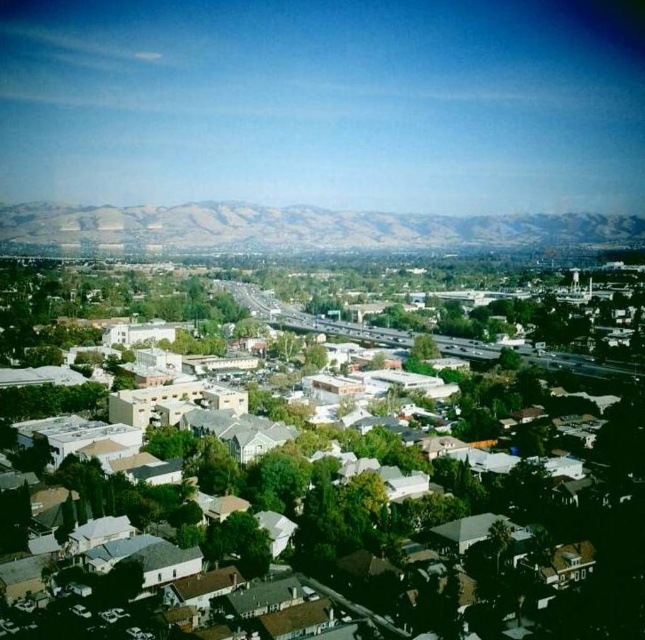
Question: Which object appears closest to the camera in this image?

Choices:
 (A) white matte houses at center
 (B) brown textured mountains at upper center

Answer: (A)

Question: Where is white matte houses at center located in relation to brown textured mountains at upper center in the image?

Choices:
 (A) above
 (B) below

Answer: (B)

Question: Considering the relative positions of white matte houses at center and brown textured mountains at upper center in the image provided, where is white matte houses at center located with respect to brown textured mountains at upper center?

Choices:
 (A) right
 (B) left

Answer: (B)

Question: Which point is farther from the camera taking this photo?

Choices:
 (A) (333, 211)
 (B) (99, 508)

Answer: (A)

Question: Can you confirm if white matte houses at center is thinner than brown textured mountains at upper center?

Choices:
 (A) no
 (B) yes

Answer: (B)